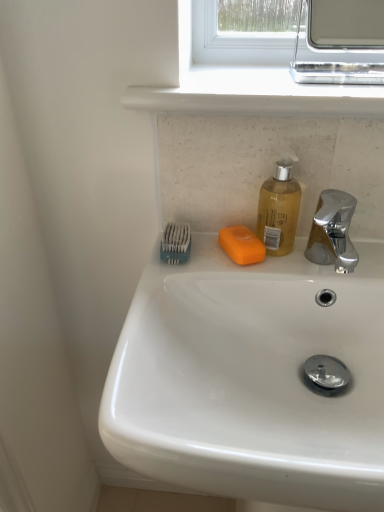
You are a GUI agent. You are given a task and a screenshot of the screen. Output one action in this format:
    pyautogui.click(x=<x>, y=<y>)
    Task: Click on the vacant region to the left of orange matte soap at center
    The width and height of the screenshot is (384, 512).
    Given the screenshot: What is the action you would take?
    pyautogui.click(x=193, y=260)